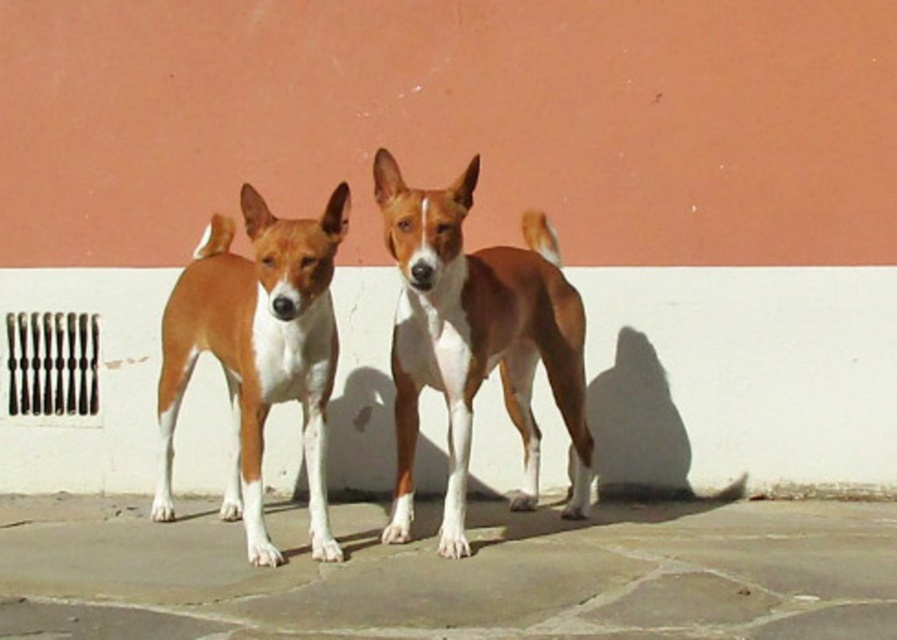
You are standing in front of the two dogs against the wall. The point at coordinates (451, 481) is where you want to place a small decoration. If you are 1.7 meters tall, can you reach that point without a ladder?

The point at coordinates (451, 481) is 5.46 meters from the camera. Since the average human arm reach is about 2.1 meters, you cannot reach that point without a ladder.

You are a delivery robot with a height of 30 inches. You need to deliver a package to the brown furry dog at center while standing on the gray stone pavement at center. Can you reach the dog without any assistance?

The gray stone pavement at center and brown furry dog at center are 32.12 inches apart from each other. Since the robot is 30 inches tall, it cannot reach the dog as the distance between them is greater than the robot height.